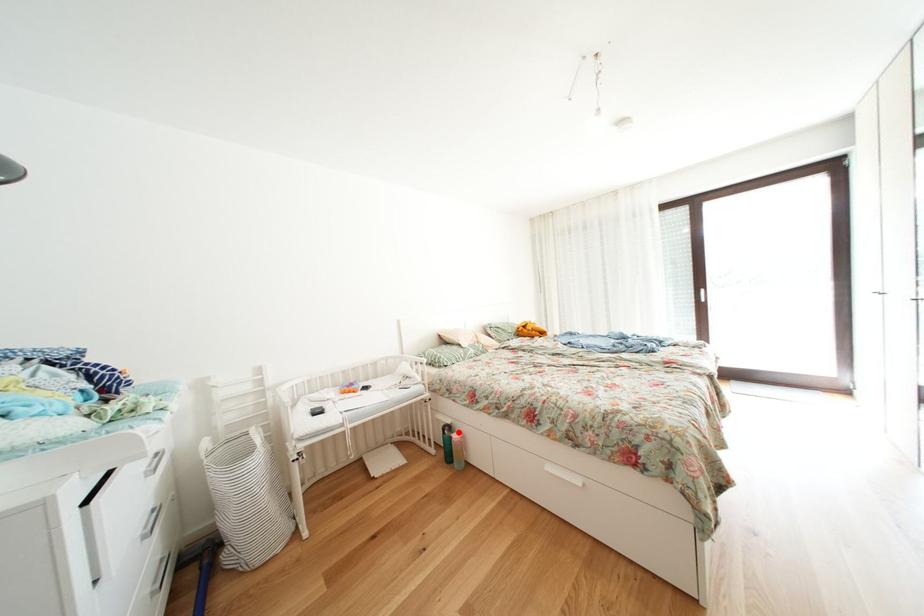
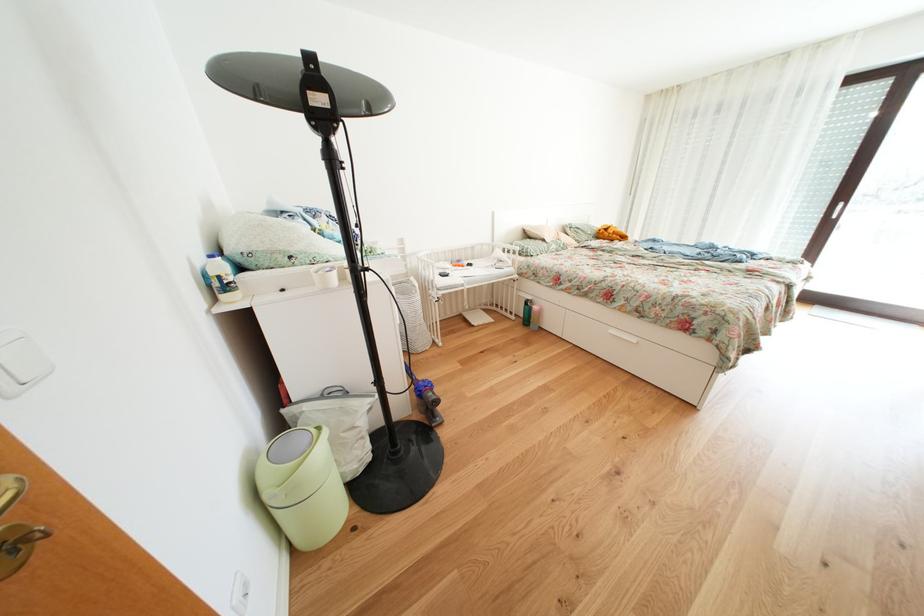
Question: A red point is marked in image1. In image2, is the corresponding 3D point closer to the camera or farther? Reply with the corresponding letter.

Choices:
 (A) The corresponding 3D point is closer.
 (B) The corresponding 3D point is farther.

Answer: (A)